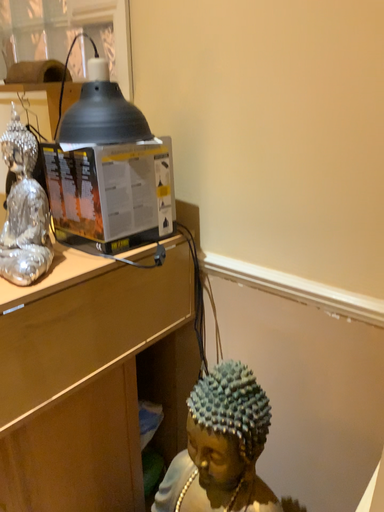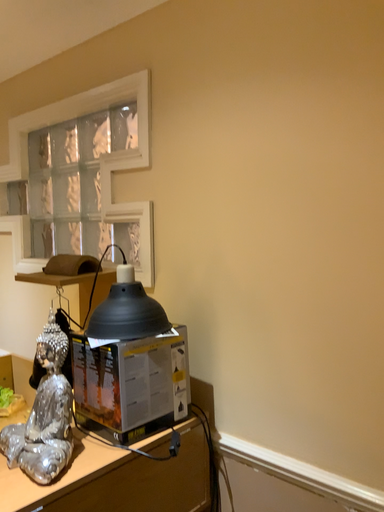
Question: Which way did the camera rotate in the video?

Choices:
 (A) rotated upward
 (B) rotated downward

Answer: (A)